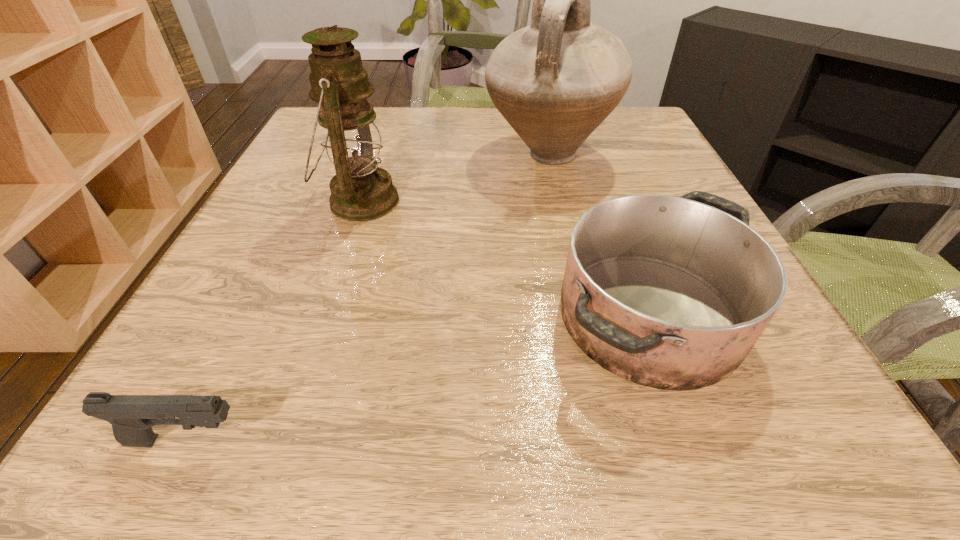
This screenshot has height=540, width=960. In order to click on object that is at the far edge in this screenshot , I will do `click(555, 81)`.

Where is `saucepan that is at the near edge`? The image size is (960, 540). saucepan that is at the near edge is located at coordinates (668, 292).

Where is `pistol that is at the near edge`? This screenshot has width=960, height=540. pistol that is at the near edge is located at coordinates (132, 416).

The height and width of the screenshot is (540, 960). What are the coordinates of `oil lamp positioned at the left edge` in the screenshot? It's located at (360, 191).

You are a GUI agent. You are given a task and a screenshot of the screen. Output one action in this format:
    pyautogui.click(x=<x>, y=<y>)
    Task: Click on the pistol situated at the left edge
    Image resolution: width=960 pixels, height=540 pixels.
    Given the screenshot: What is the action you would take?
    pyautogui.click(x=132, y=416)

At what (x,y) coordinates should I click in order to perform the action: click on pitcher located at the right edge. Please return your answer as a coordinate pair (x, y). Looking at the image, I should click on (555, 81).

Locate an element on the screen. The width and height of the screenshot is (960, 540). saucepan that is at the right edge is located at coordinates (668, 292).

In order to click on object situated at the near left corner in this screenshot , I will do `click(132, 416)`.

Where is `object at the far right corner`? The image size is (960, 540). object at the far right corner is located at coordinates (555, 81).

This screenshot has height=540, width=960. Find the location of `object present at the near right corner`. object present at the near right corner is located at coordinates (668, 292).